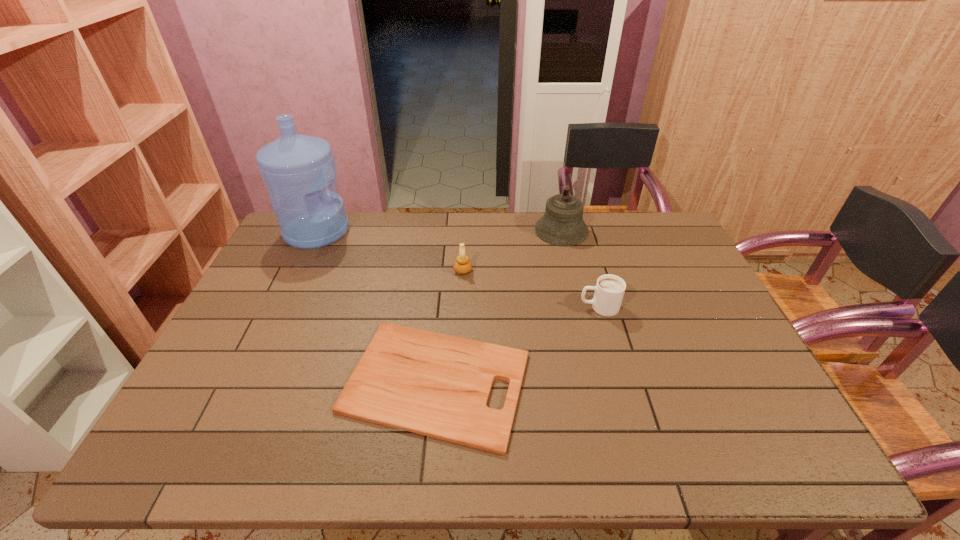
You are a GUI agent. You are given a task and a screenshot of the screen. Output one action in this format:
    pyautogui.click(x=<x>, y=<y>)
    Task: Click on the water jug
    
    Given the screenshot: What is the action you would take?
    pyautogui.click(x=297, y=170)

I want to click on the leftmost object, so click(x=297, y=170).

I want to click on bell, so click(562, 224).

Locate an element on the screen. This screenshot has height=540, width=960. the third farthest object is located at coordinates (462, 266).

At what (x,y) coordinates should I click in order to perform the action: click on candle_holder. Please return your answer as a coordinate pair (x, y). The width and height of the screenshot is (960, 540). Looking at the image, I should click on (462, 266).

The image size is (960, 540). What are the coordinates of `the fourth tallest object` in the screenshot? It's located at (609, 290).

At what (x,y) coordinates should I click in order to perform the action: click on cappuccino. Please return your answer as a coordinate pair (x, y). This screenshot has height=540, width=960. Looking at the image, I should click on (609, 290).

This screenshot has width=960, height=540. I want to click on chopping board, so click(437, 385).

I want to click on the shortest object, so click(437, 385).

Identify the location of vacant position located on the side of the leftmost object with the handle. (405, 231).